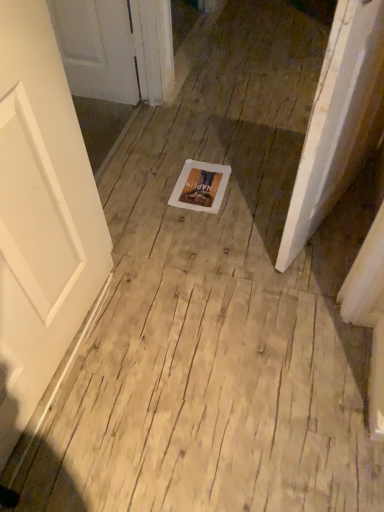
Question: From a real-world perspective, relative to white paper at center, is light brown wood floor at center vertically above or below?

Choices:
 (A) above
 (B) below

Answer: (B)

Question: Is point (246, 351) closer or farther from the camera than point (193, 168)?

Choices:
 (A) closer
 (B) farther

Answer: (A)

Question: Is light brown wood floor at center situated inside white paper at center or outside?

Choices:
 (A) inside
 (B) outside

Answer: (B)

Question: From the image's perspective, relative to light brown wood floor at center, is white paper at center above or below?

Choices:
 (A) above
 (B) below

Answer: (A)

Question: Relative to light brown wood floor at center, is white paper at center in front or behind?

Choices:
 (A) front
 (B) behind

Answer: (B)

Question: From their relative heights in the image, would you say white paper at center is taller or shorter than light brown wood floor at center?

Choices:
 (A) short
 (B) tall

Answer: (A)

Question: Is white paper at center wider or thinner than light brown wood floor at center?

Choices:
 (A) thin
 (B) wide

Answer: (A)